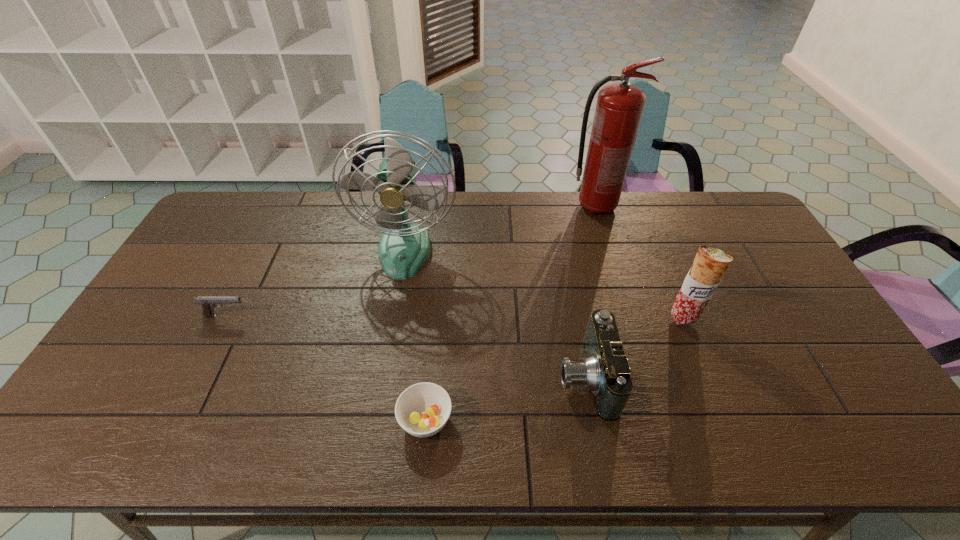
The width and height of the screenshot is (960, 540). Find the location of `blank space that satisfies the following two spatial constraints: 1. in front of the second farthest object, directing airflow; 2. at the barrel of the leftmost object`. blank space that satisfies the following two spatial constraints: 1. in front of the second farthest object, directing airflow; 2. at the barrel of the leftmost object is located at coordinates (394, 316).

The image size is (960, 540). Identify the location of free spot that satisfies the following two spatial constraints: 1. in front of the second farthest object, directing airflow; 2. at the barrel of the pistol. (394, 316).

The height and width of the screenshot is (540, 960). Identify the location of free spot that satisfies the following two spatial constraints: 1. on the handle side the tallest object; 2. on the left side of the burrito. (629, 318).

Where is `free spot that satisfies the following two spatial constraints: 1. in front of the fan, directing airflow; 2. on the right side of the burrito`? free spot that satisfies the following two spatial constraints: 1. in front of the fan, directing airflow; 2. on the right side of the burrito is located at coordinates (394, 318).

Identify the location of vacant region that satisfies the following two spatial constraints: 1. on the back side of the rightmost object; 2. on the handle side the farthest object. (637, 207).